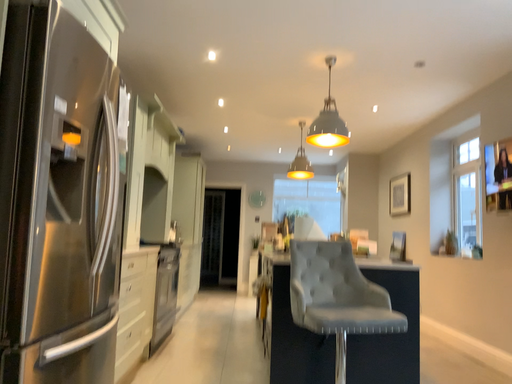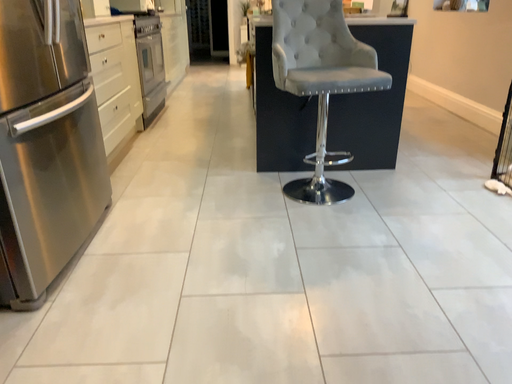
Question: How did the camera likely rotate when shooting the video?

Choices:
 (A) rotated upward
 (B) rotated downward

Answer: (B)